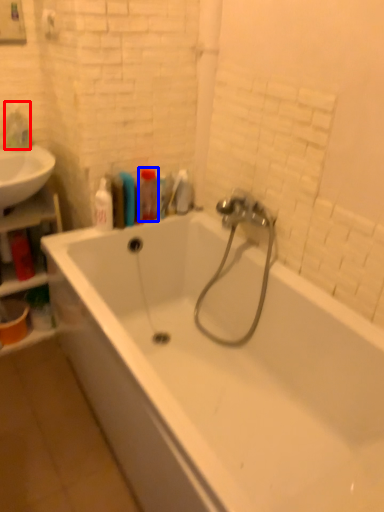
Question: Which point is closer to the camera, toiletry (highlighted by a red box) or toiletry (highlighted by a blue box)?

Choices:
 (A) toiletry
 (B) toiletry

Answer: (B)